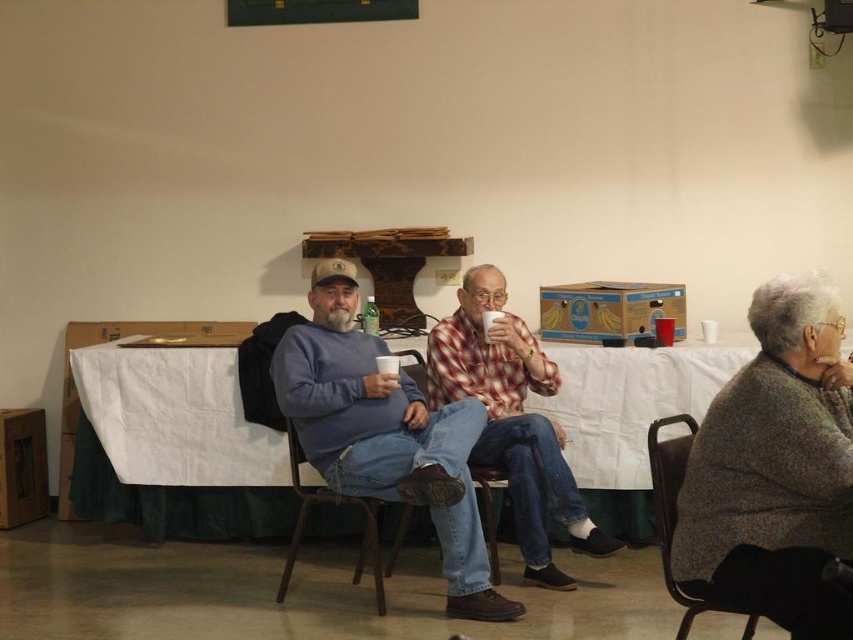
Question: Can you confirm if white cloth-covered table at center is smaller than denim fabric chair at center?

Choices:
 (A) no
 (B) yes

Answer: (A)

Question: Does plaid fabric shirt at center appear on the left side of metallic brown chair at center?

Choices:
 (A) no
 (B) yes

Answer: (A)

Question: Which point is farther to the camera?

Choices:
 (A) matte blue sweater at center
 (B) white paper cup at center

Answer: (B)

Question: Which object appears farthest from the camera in this image?

Choices:
 (A) plaid fabric shirt at center
 (B) denim fabric chair at center
 (C) metallic brown chair at center
 (D) white paper cup at center

Answer: (D)

Question: Can you confirm if plaid fabric shirt at center is positioned above dark gray fabric chair at lower right?

Choices:
 (A) yes
 (B) no

Answer: (A)

Question: Considering the real-world distances, which object is closest to the gray wool sweater at center?

Choices:
 (A) denim fabric chair at center
 (B) white paper cup at center
 (C) white cloth-covered table at center

Answer: (A)